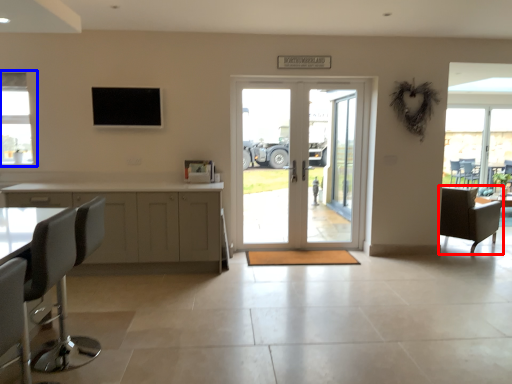
Question: Which object is further to the camera taking this photo, chair (highlighted by a red box) or window (highlighted by a blue box)?

Choices:
 (A) chair
 (B) window

Answer: (A)